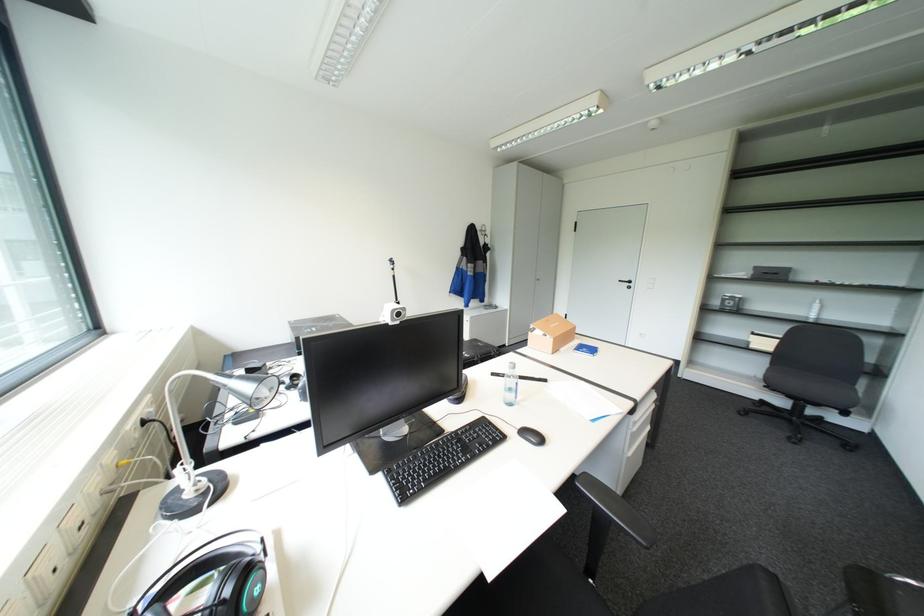
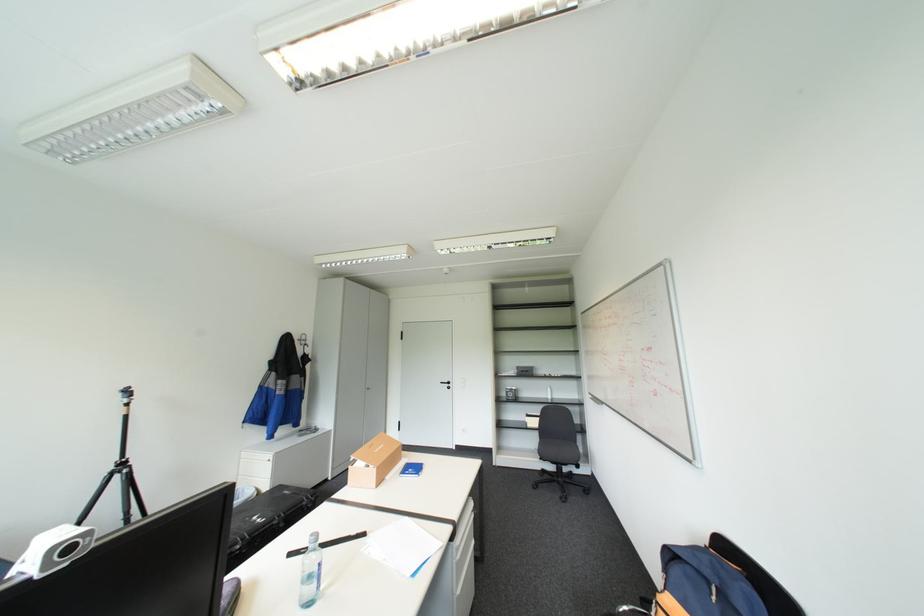
Where in the second image is the point corresponding to [514,389] from the first image?

(310, 581)